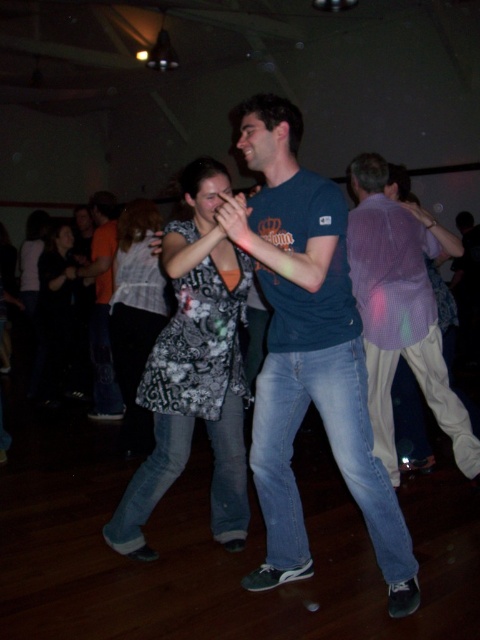
You are a GUI agent. You are given a task and a screenshot of the screen. Output one action in this format:
    pyautogui.click(x=<x>, y=<y>)
    Task: Click on the blue cotton t-shirt at center
    
    Given the screenshot: What is the action you would take?
    pyautogui.click(x=308, y=352)

Does blue cotton t-shirt at center have a lesser width compared to black fabric dress at left?

No.

Is point (407, 540) positioned behind point (52, 237)?

No, it is not.

Identify the location of blue cotton t-shirt at center. (308, 352).

Is light purple checkered shirt at right positioned behind orange t-shirt at center?

No, it is not.

Which is behind, point (410, 344) or point (100, 291)?

The point (100, 291) is more distant.

At what (x,y) coordinates should I click in order to perform the action: click on light purple checkered shirt at right. Please return your answer as a coordinate pair (x, y). The width and height of the screenshot is (480, 640). Looking at the image, I should click on (402, 310).

Where is `light purple checkered shirt at right`? light purple checkered shirt at right is located at coordinates (402, 310).

Is black fabric dress at left wider than orange t-shirt at center?

Yes, black fabric dress at left is wider than orange t-shirt at center.

Who is positioned more to the right, black fabric dress at left or orange t-shirt at center?

Positioned to the right is orange t-shirt at center.

The width and height of the screenshot is (480, 640). Describe the element at coordinates (55, 314) in the screenshot. I see `black fabric dress at left` at that location.

At what (x,y) coordinates should I click in order to perform the action: click on black fabric dress at left. Please return your answer as a coordinate pair (x, y). Looking at the image, I should click on (55, 314).